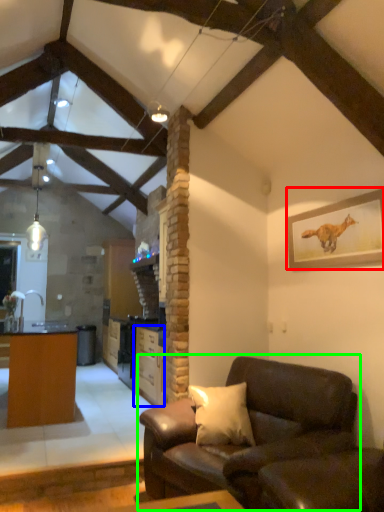
Question: Which object is positioned closest to picture frame (highlighted by a red box)? Select from cabinetry (highlighted by a blue box) and studio couch (highlighted by a green box).

Choices:
 (A) cabinetry
 (B) studio couch

Answer: (B)